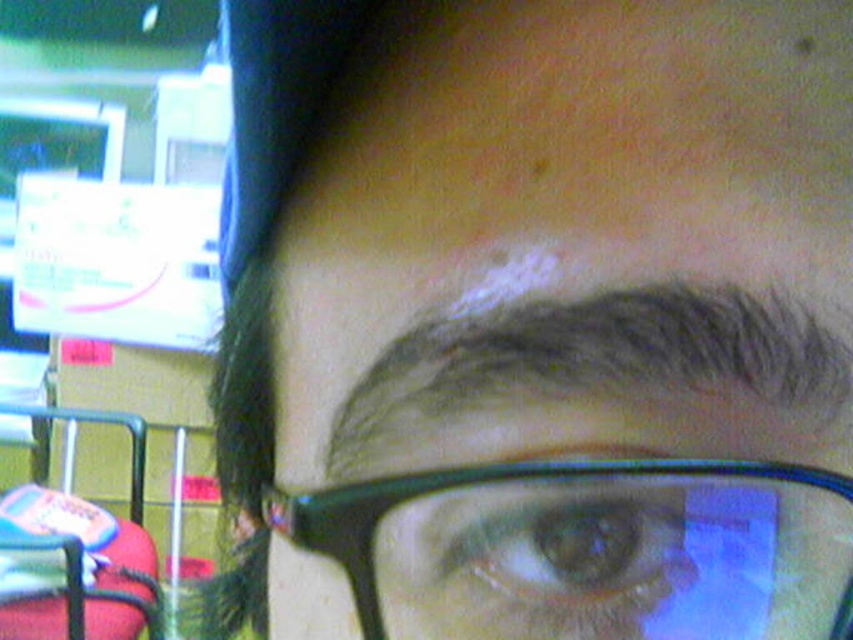
You are a customer in a store and you see the black plastic glasses at center. Where exactly are they located in the image?

The black plastic glasses at center are located at point (589, 550) in the image.

You are a security camera observing a person wearing black plastic glasses at center and having a brown matte eye at center. Which object is bigger in the image?

The black plastic glasses at center has a larger size compared to the brown matte eye at center.

You are a photographer trying to adjust your camera focus. You notice the black plastic glasses at center and the brown matte eye at center in your viewfinder. Which object is positioned higher in the frame?

The black plastic glasses at center is located above the brown matte eye at center, so it is positioned higher in the frame.